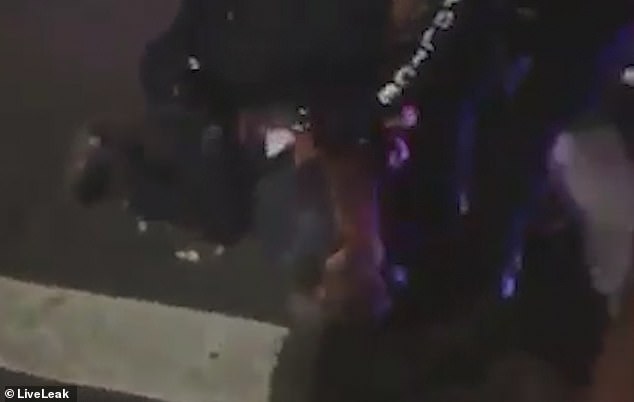
Find the location of `light`. light is located at coordinates (276, 139).